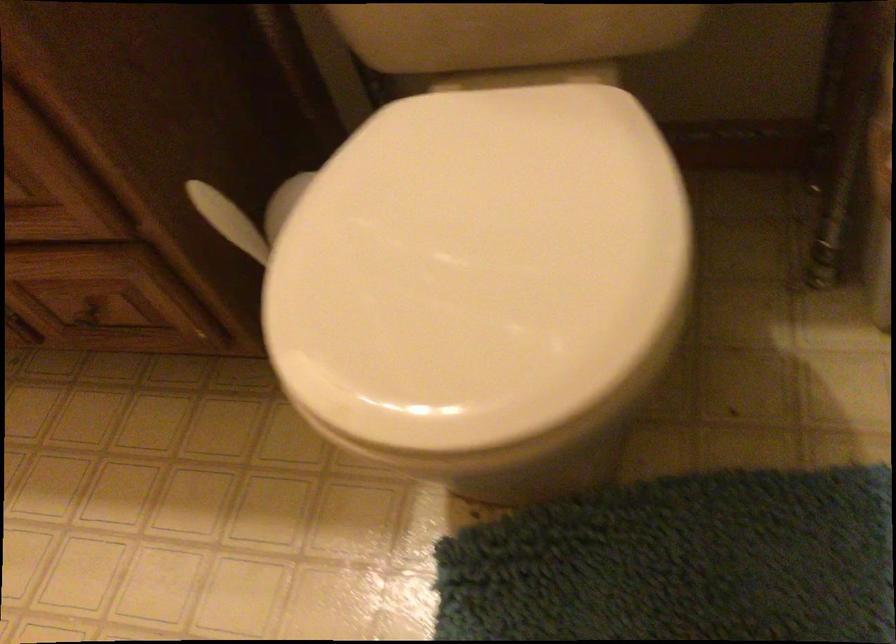
Find the location of a particular element. The width and height of the screenshot is (896, 644). white flush lever is located at coordinates (222, 214).